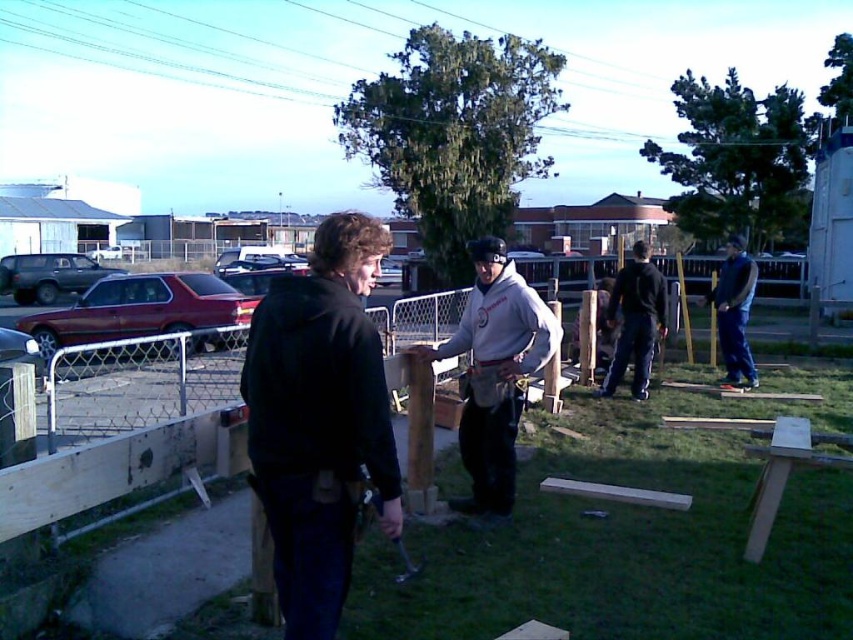
You are a photographer trying to capture a candid shot of the two workers in the scene. You want to ensure that both the black matte jacket at center and the dark gray hoodie at center are clearly visible in the frame. Given their positions and sizes, which worker should you focus on first to ensure the jacket and hoodie are in focus?

The black matte jacket at center has a greater height compared to the dark gray hoodie at center, so you should focus on the worker wearing the black matte jacket at center first to ensure both are in focus.

You are observing two workers in the scene. Which object, the black matte jacket at center or the blue jeans at right, is shorter in height?

The black matte jacket at center is not as tall as the blue jeans at right, so the black matte jacket at center is shorter in height.

Based on the coordinates provided, which object is located at point (318, 419) in the image?

The point (318, 419) marks the location of the black matte jacket at center.